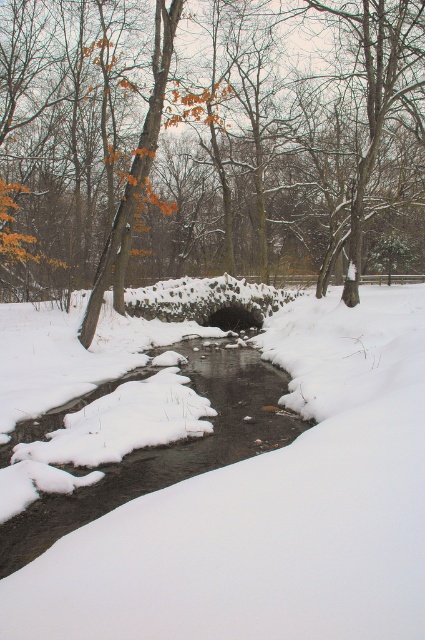
You are a hiker who wants to cross the stream safely. You see the brown textured rock at center and the clear water at center. Which object should you avoid stepping on to prevent slipping?

You should avoid stepping on the clear water at center because it is behind the brown textured rock at center, indicating it might be deeper or more slippery than the rock.

You are standing at the edge of a snow covered stream and see a brown textured rock at center and a clear water at center. Which object is positioned to the right of the other?

The brown textured rock at center is to the right of clear water at center.